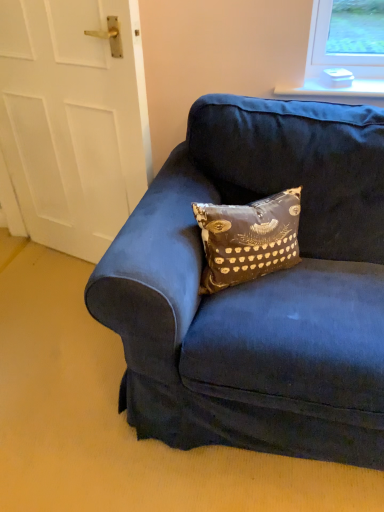
The image size is (384, 512). What do you see at coordinates (73, 120) in the screenshot?
I see `white matte door at left` at bounding box center [73, 120].

This screenshot has width=384, height=512. I want to click on white matte door at left, so click(x=73, y=120).

Image resolution: width=384 pixels, height=512 pixels. I want to click on white matte door at left, so click(x=73, y=120).